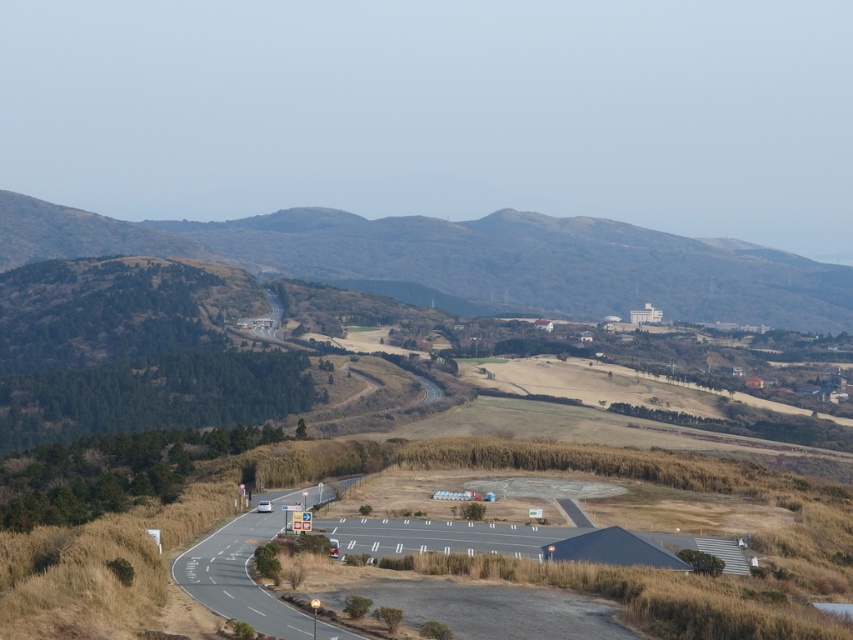
Who is taller, asphalt road at lower center or white asphalt highway at lower left?

white asphalt highway at lower left is taller.

Find the location of a particular element. This screenshot has height=640, width=853. asphalt road at lower center is located at coordinates (490, 608).

The height and width of the screenshot is (640, 853). What do you see at coordinates (490, 608) in the screenshot?
I see `asphalt road at lower center` at bounding box center [490, 608].

Locate an element on the screen. The height and width of the screenshot is (640, 853). asphalt road at lower center is located at coordinates (490, 608).

Which of these two, brown textured hillside at upper center or white asphalt highway at lower left, stands taller?

brown textured hillside at upper center is taller.

Which of these two, brown textured hillside at upper center or white asphalt highway at lower left, stands shorter?

white asphalt highway at lower left is shorter.

Who is more distant from viewer, (614,291) or (276,620)?

Positioned behind is point (614,291).

I want to click on brown textured hillside at upper center, so click(x=469, y=259).

Is brown textured hillside at upper center to the left of asphalt road at lower center from the viewer's perspective?

Incorrect, brown textured hillside at upper center is not on the left side of asphalt road at lower center.

Identify the location of brown textured hillside at upper center. (469, 259).